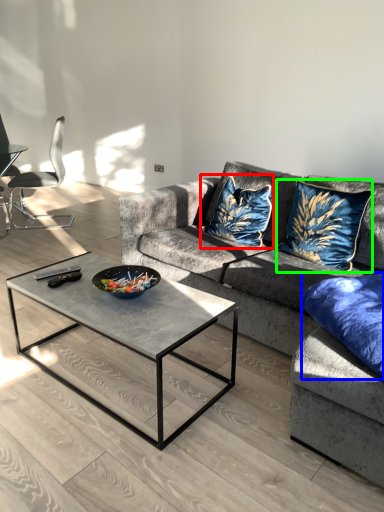
Question: Which is nearer to the throw pillow (highlighted by a red box)? pillow (highlighted by a blue box) or throw pillow (highlighted by a green box).

Choices:
 (A) pillow
 (B) throw pillow

Answer: (B)